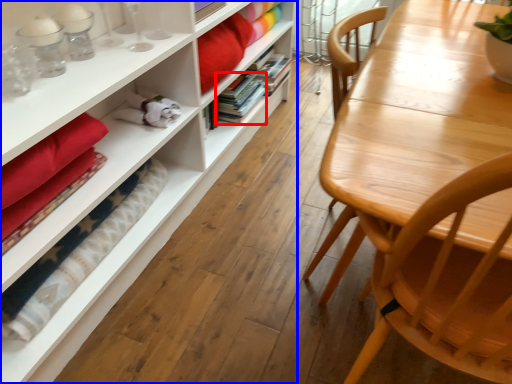
Question: Which object is closer to the camera taking this photo, book (highlighted by a red box) or bookcase (highlighted by a blue box)?

Choices:
 (A) book
 (B) bookcase

Answer: (B)